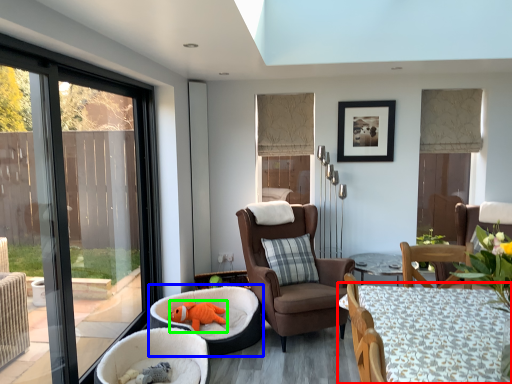
Question: Based on their relative distances, which object is nearer to table (highlighted by a red box)? Choose from infant bed (highlighted by a blue box) and animal (highlighted by a green box).

Choices:
 (A) infant bed
 (B) animal

Answer: (A)